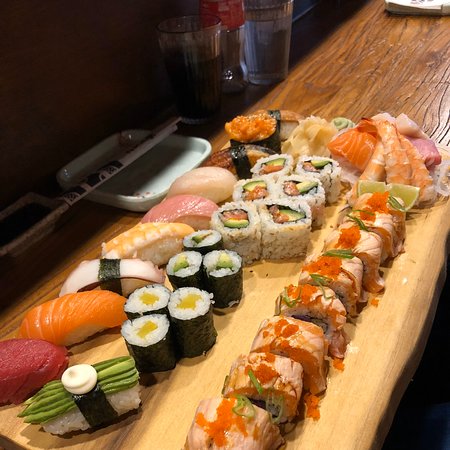
Image resolution: width=450 pixels, height=450 pixels. Find the location of `glass`. glass is located at coordinates (195, 62).